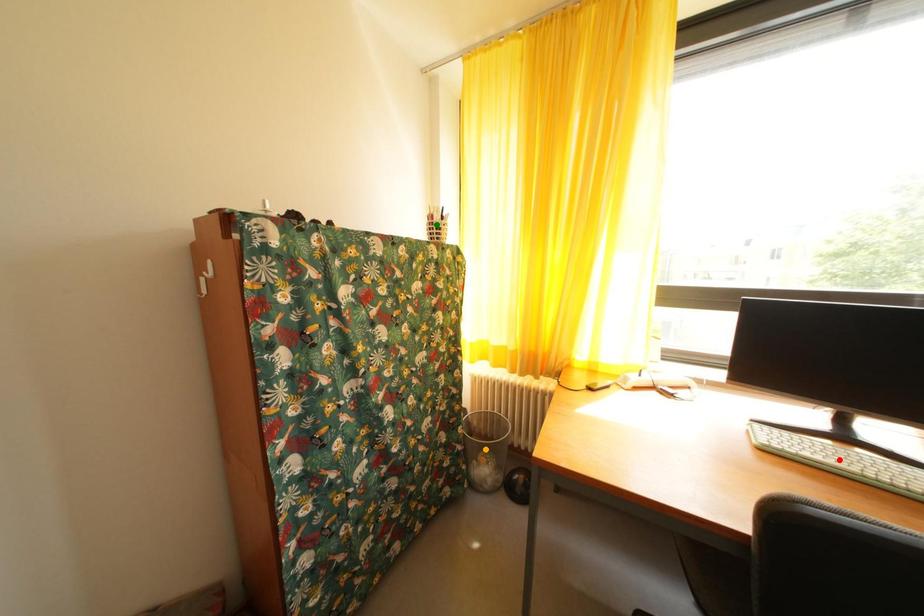
Order these from nearest to farthest:
green point
red point
orange point

red point → green point → orange point